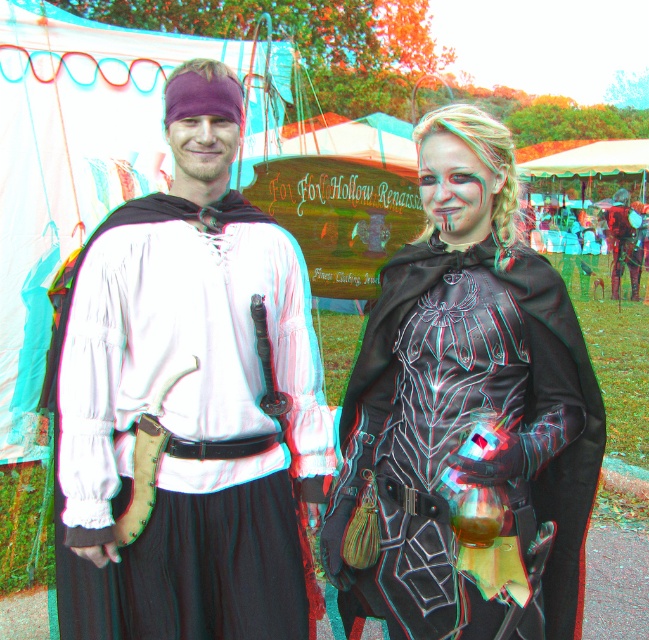
You are a photographer at the Renaissance fair and want to take a group photo of the two people. The minimum distance required for your camera to focus properly is 6 feet. Will the distance between the matte white shirt at center and the other person be sufficient for the camera to focus?

The two individuals are 6.42 feet apart, which exceeds the camera minimum focusing distance of 6 feet. Therefore, the distance between the matte white shirt at center and the other person is sufficient for the camera to focus.

You are a photographer at the Renaissance fair. You need to position a spotlight on the matte white shirt at center and the black leather cape at center. Since the spotlight can only illuminate one object at a time, which one should you aim it at first if you want to follow the left to right rule?

The matte white shirt at center is to the left of the black leather cape at center. Following the left to right rule, you should aim the spotlight at the matte white shirt at center first before moving it to the black leather cape at center.

You are a costume designer measuring the distance between two costume elements for a stage play. You see the matte white shirt at center and the black leather cape at center. Is the distance between them sufficient to allow a 18 inch wide prop to fit between them without touching either?

The matte white shirt at center and black leather cape at center are 19.18 inches apart, which is more than enough to fit an 18 inch wide prop between them without touching either.